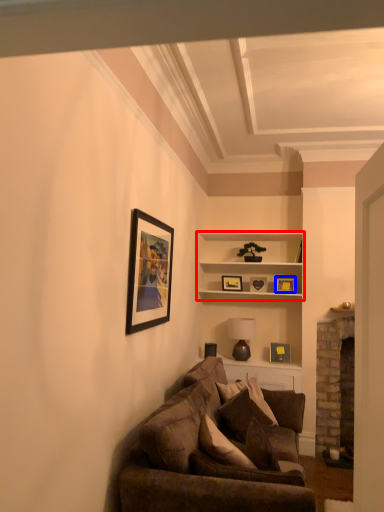
Question: Which object is closer to the camera taking this photo, shelf (highlighted by a red box) or picture frame (highlighted by a blue box)?

Choices:
 (A) shelf
 (B) picture frame

Answer: (A)